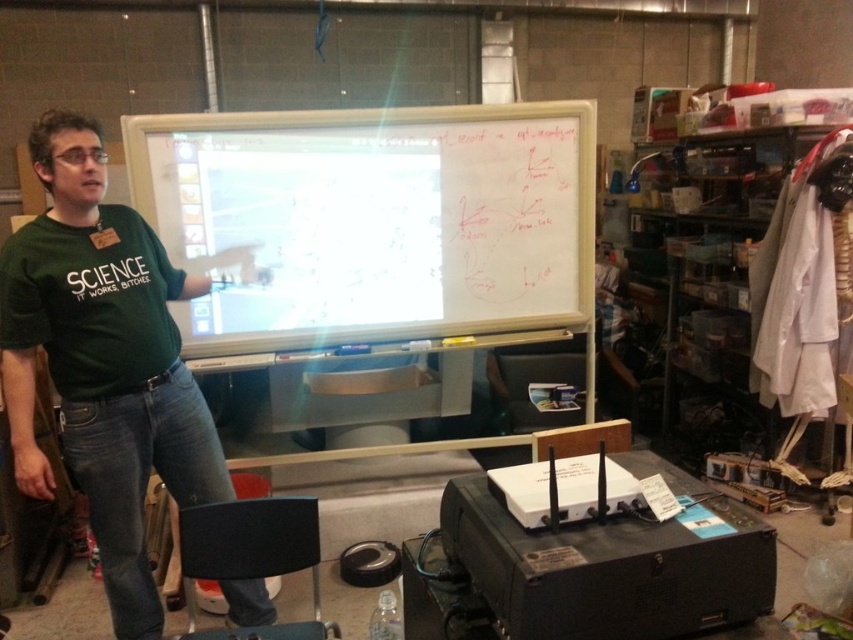
Does green matte shirt at center lie behind green fabric shirt at left?

No, it is not.

Between green matte shirt at center and green fabric shirt at left, which one appears on the right side from the viewer's perspective?

green matte shirt at center

Is point (123, 440) farther from viewer compared to point (73, 276)?

Yes.

This screenshot has height=640, width=853. I want to click on green matte shirt at center, so click(x=103, y=365).

Between whiteboard at center and green fabric shirt at left, which one appears on the right side from the viewer's perspective?

From the viewer's perspective, whiteboard at center appears more on the right side.

Image resolution: width=853 pixels, height=640 pixels. Identify the location of whiteboard at center. (374, 220).

Image resolution: width=853 pixels, height=640 pixels. In order to click on whiteboard at center in this screenshot , I will do `click(374, 220)`.

Between whiteboard at center and green matte shirt at center, which one has less height?

Standing shorter between the two is whiteboard at center.

Is whiteboard at center below green matte shirt at center?

No.

Is point (257, 129) positioned before point (70, 301)?

No, it is not.

Find the location of a particular element. The image size is (853, 640). whiteboard at center is located at coordinates (374, 220).